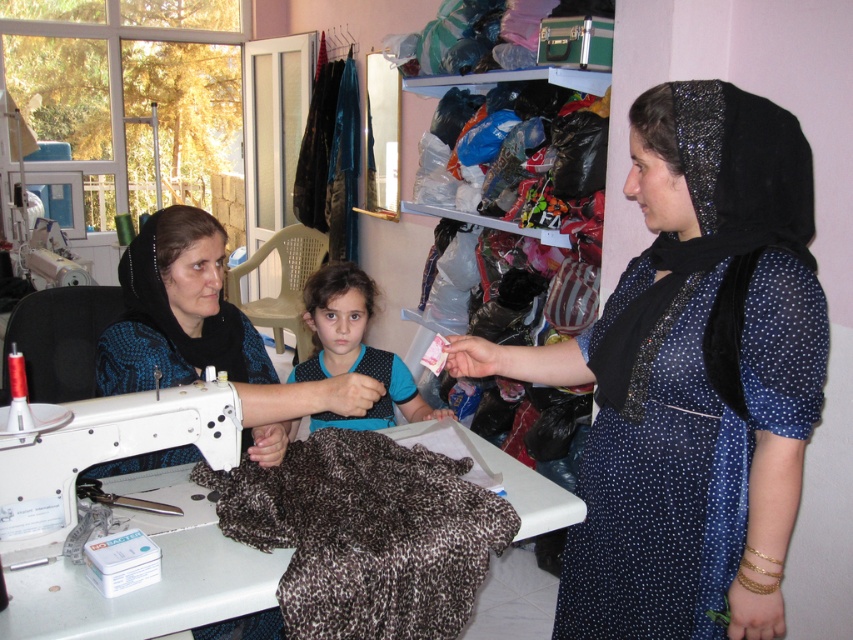
The width and height of the screenshot is (853, 640). Describe the element at coordinates (693, 376) in the screenshot. I see `dark blue dotted dress at center` at that location.

Who is taller, dark blue dotted dress at center or white plastic sewing machine at lower left?

dark blue dotted dress at center

Locate an element on the screen. The height and width of the screenshot is (640, 853). dark blue dotted dress at center is located at coordinates (693, 376).

Is point (486, 557) positioned behind point (61, 525)?

Yes.

Which is behind, point (474, 515) or point (24, 445)?

Point (474, 515)

This screenshot has height=640, width=853. What do you see at coordinates (364, 532) in the screenshot?
I see `brown textured fabric at center` at bounding box center [364, 532].

Find the location of a particular element. This screenshot has height=640, width=853. brown textured fabric at center is located at coordinates (364, 532).

Who is positioned more to the right, brown textured fabric at center or brown fuzzy fabric at lower left?

brown textured fabric at center

Is point (305, 540) less distant than point (169, 356)?

Yes, point (305, 540) is in front of point (169, 356).

Which is in front, point (352, 525) or point (167, 339)?

Point (352, 525) is in front.

Identify the location of brown textured fabric at center. (364, 532).